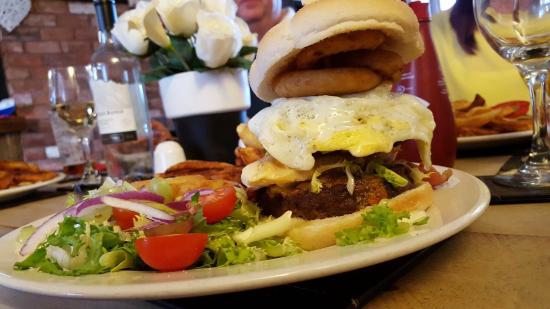
This screenshot has height=309, width=550. What are the coordinates of `pot` in the screenshot? It's located at (212, 126).